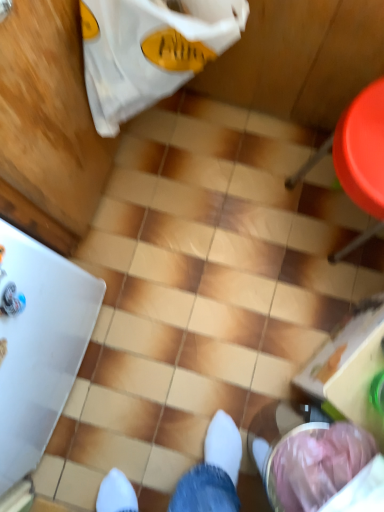
Question: Does red plastic chair at right have a greater width compared to white fabric grocery bag at upper left?

Choices:
 (A) yes
 (B) no

Answer: (A)

Question: Is red plastic chair at right looking in the opposite direction of white fabric grocery bag at upper left?

Choices:
 (A) yes
 (B) no

Answer: (B)

Question: Is red plastic chair at right in front of white fabric grocery bag at upper left?

Choices:
 (A) no
 (B) yes

Answer: (A)

Question: Can white fabric grocery bag at upper left be found inside red plastic chair at right?

Choices:
 (A) yes
 (B) no

Answer: (B)

Question: Is red plastic chair at right aimed at white fabric grocery bag at upper left?

Choices:
 (A) yes
 (B) no

Answer: (B)

Question: From the image's perspective, would you say red plastic chair at right is shown under white fabric grocery bag at upper left?

Choices:
 (A) no
 (B) yes

Answer: (B)

Question: Is white fabric grocery bag at upper left next to red plastic chair at right?

Choices:
 (A) yes
 (B) no

Answer: (B)

Question: Is white fabric grocery bag at upper left positioned with its back to red plastic chair at right?

Choices:
 (A) no
 (B) yes

Answer: (A)

Question: Does white fabric grocery bag at upper left have a lesser height compared to red plastic chair at right?

Choices:
 (A) yes
 (B) no

Answer: (B)

Question: From a real-world perspective, is white fabric grocery bag at upper left located beneath red plastic chair at right?

Choices:
 (A) no
 (B) yes

Answer: (A)

Question: From a real-world perspective, is white fabric grocery bag at upper left on red plastic chair at right?

Choices:
 (A) no
 (B) yes

Answer: (B)

Question: Is white fabric grocery bag at upper left in front of red plastic chair at right?

Choices:
 (A) yes
 (B) no

Answer: (A)

Question: Does point (311, 160) appear closer or farther from the camera than point (193, 68)?

Choices:
 (A) farther
 (B) closer

Answer: (A)